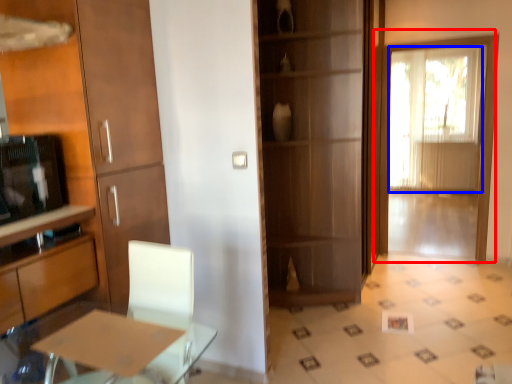
Question: Which object is further to the camera taking this photo, door (highlighted by a red box) or window screen (highlighted by a blue box)?

Choices:
 (A) door
 (B) window screen

Answer: (B)